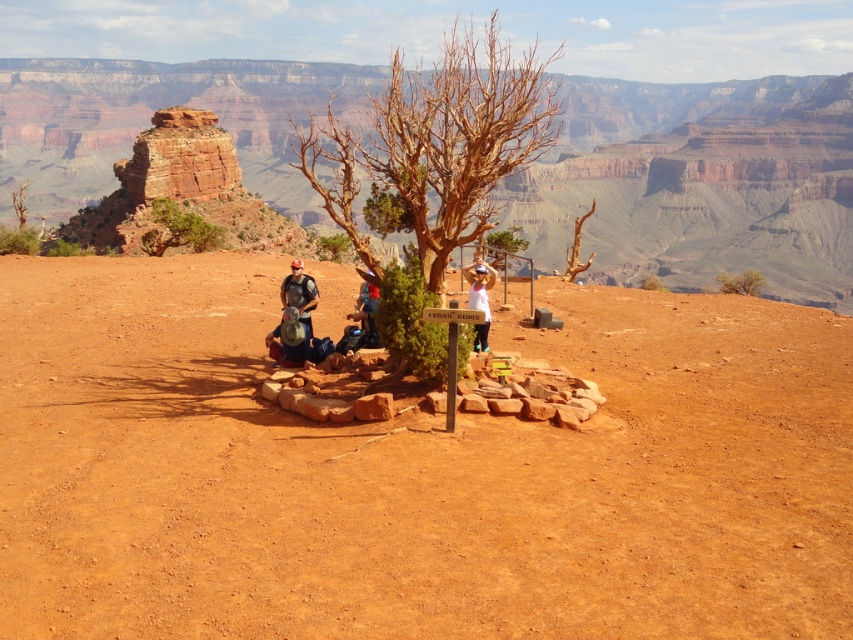
Question: Which is nearer to the rustic rock formation at center?

Choices:
 (A) brown bark tree at center
 (B) dull red dirt at center
 (C) blue fabric backpack at center
 (D) matte gray backpack at center

Answer: (A)

Question: Can you confirm if brown textured tree at center is positioned below green leafy bush at right?

Choices:
 (A) no
 (B) yes

Answer: (A)

Question: Can you confirm if rustic rock formation at center is positioned to the right of green leafy bush at right?

Choices:
 (A) no
 (B) yes

Answer: (A)

Question: Which of the following is the closest to the observer?

Choices:
 (A) (349, 211)
 (B) (39, 60)
 (C) (471, 296)

Answer: (A)

Question: Which point appears closest to the camera in this image?

Choices:
 (A) (641, 381)
 (B) (299, 317)
 (C) (489, 314)

Answer: (A)

Question: Can you confirm if dull red dirt at center is positioned to the left of brown bark tree at center?

Choices:
 (A) yes
 (B) no

Answer: (B)